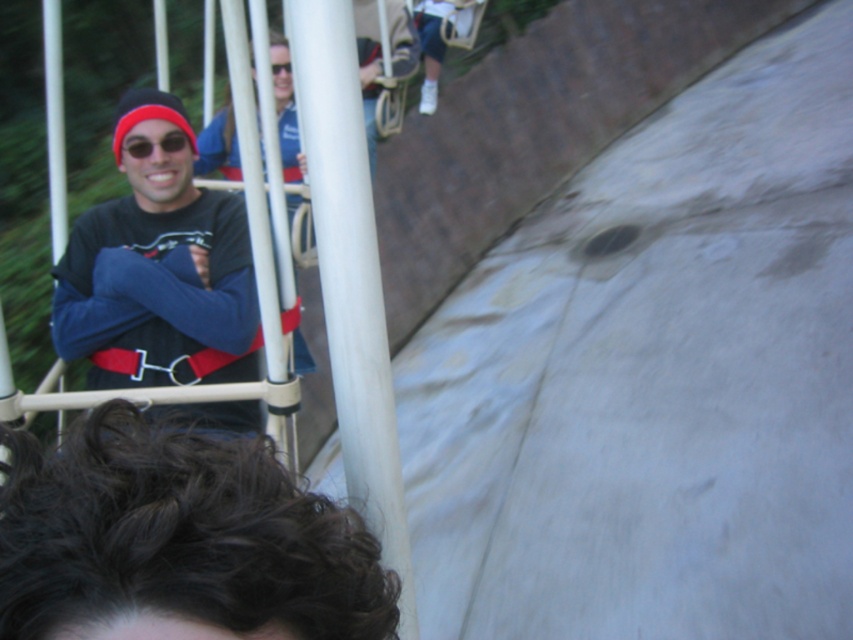
Can you confirm if dark brown hair at upper left is positioned below matte black shirt at left?

Indeed, dark brown hair at upper left is positioned under matte black shirt at left.

Is dark brown hair at upper left taller than matte black shirt at left?

No.

Is point (161, 496) less distant than point (228, 216)?

Yes, it is in front of point (228, 216).

Find the location of a particular element. The width and height of the screenshot is (853, 640). dark brown hair at upper left is located at coordinates (178, 540).